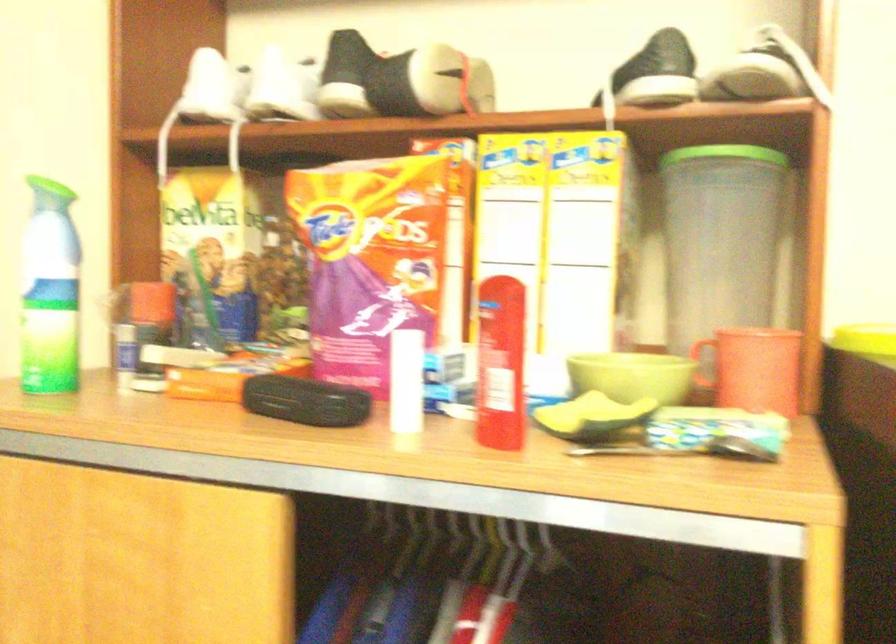
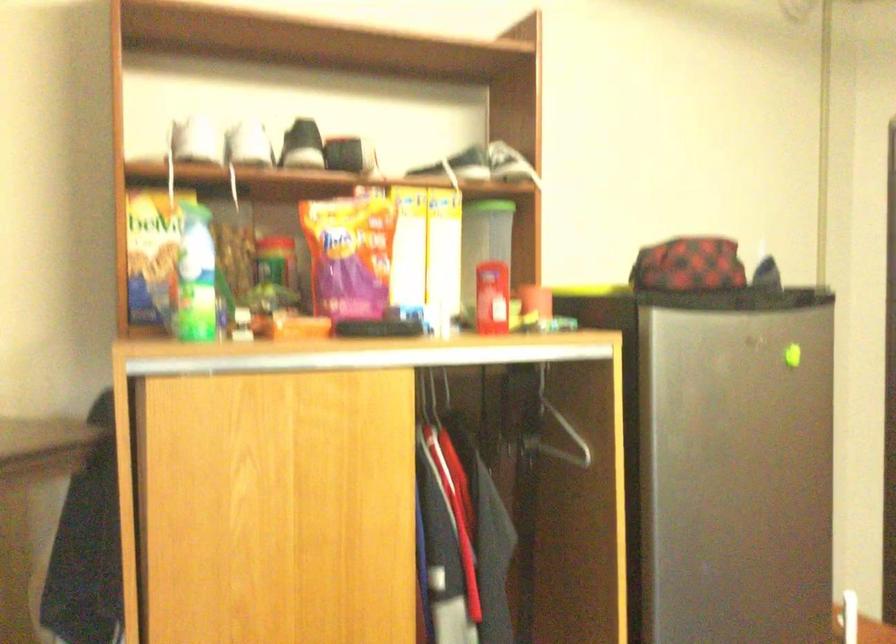
Locate, in the second image, the point that corresponds to pixel 780 234 in the first image.

(483, 243)